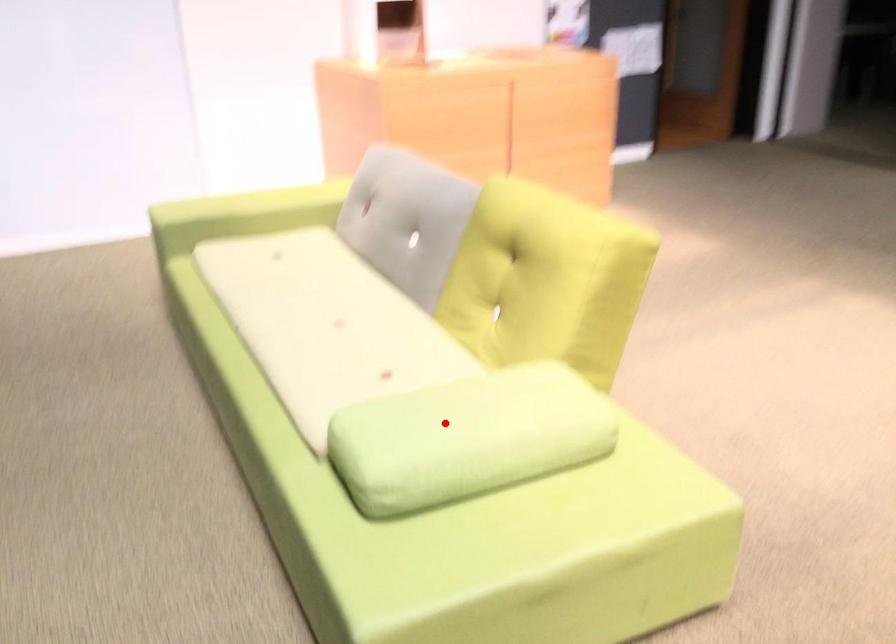
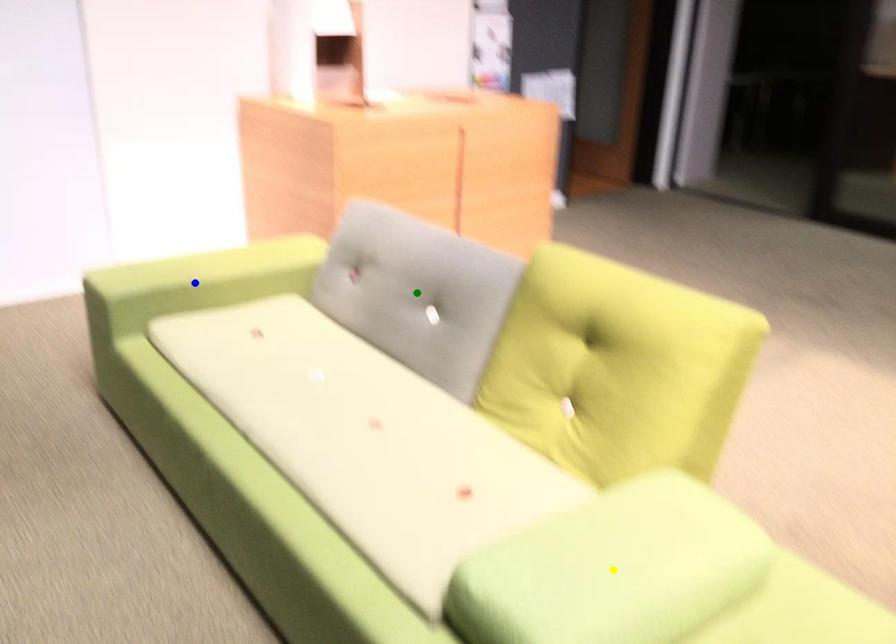
Question: I am providing you with two images of the same scene from different viewpoints. A red point is marked on the first image. You are given multiple points on the second image. Which spot in image 2 lines up with the point in image 1?

Choices:
 (A) yellow point
 (B) blue point
 (C) green point

Answer: (A)